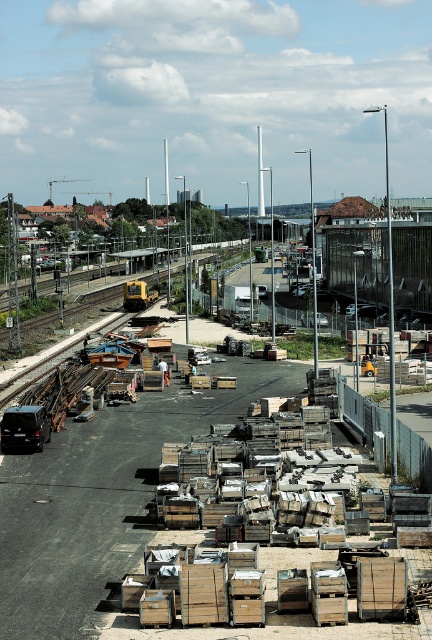
You are standing at the point with coordinates point (139, 280) and want to walk to the point (22, 545). Given that there are railway tracks in the midground, will you have to cross the tracks to reach your destination?

Point (22, 545) is in front of point (139, 280), so you will not have to cross the railway tracks to reach your destination.

You are a construction worker who needs to move a 20 meter long steel beam from the wooden crates at center to the loading dock at the far end of the site. Can you safely transport the beam without it extending beyond the available space between the crates?

The wooden crates at center are 18.48 meters apart. Since the steel beam is 20 meters long, it would extend beyond the space between them, making it unsafe to transport without adjustments or moving the crates first.

You are a construction worker standing at the origin point of the image. You need to place a new wooden crate exactly at the midpoint between the wooden crates at center and the yellow train approaching from the left. What are the coordinates of this midpoint?

The wooden crates at center are located at point (101, 499). To find the midpoint between them and the yellow train approaching from the left, we need the coordinates of the train. However, the provided information does not specify the exact coordinates of the yellow train. Without this data, the midpoint cannot be accurately determined.